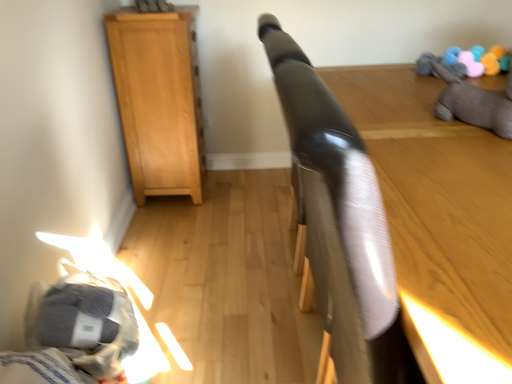
You are a GUI agent. You are given a task and a screenshot of the screen. Output one action in this format:
    pyautogui.click(x=<x>, y=<y>)
    Task: Click on the spots to the right of light brown wood cabinet at left, the second furniture positioned from the right
    
    Given the screenshot: What is the action you would take?
    pyautogui.click(x=238, y=195)